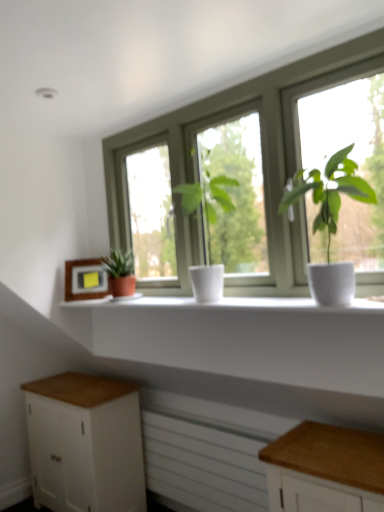
The width and height of the screenshot is (384, 512). I want to click on vacant area on top of white matte window at center (from a real-world perspective), so click(218, 93).